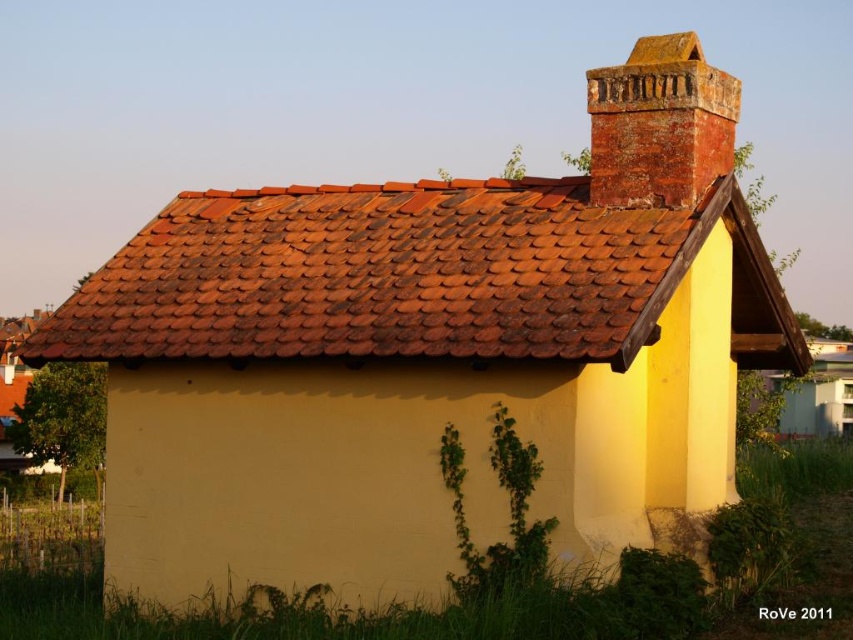
You are an architect assessing the roof structure of the building. You need to compare the width of the rusty clay tiles at upper center and the rusty brick chimney at upper right. Which one has a greater width?

The rusty clay tiles at upper center have a greater width than the rusty brick chimney at upper right.

You are standing in front of the building and notice two points marked on its roof. The first point is at coordinates point (422, 301) and the second is at point (650, 65). Which of these points is closer to your current position?

Point (422, 301) is closer to the camera than point (650, 65), so the first point is closer to your current position.